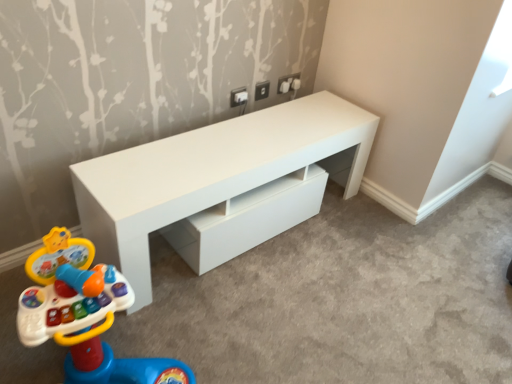
Question: Considering the positions of point (140, 201) and point (111, 281), is point (140, 201) closer or farther from the camera than point (111, 281)?

Choices:
 (A) closer
 (B) farther

Answer: (B)

Question: Is white glossy table at center in front of or behind plastic multicolored xylophone at lower left in the image?

Choices:
 (A) front
 (B) behind

Answer: (B)

Question: Based on their positions, is white glossy table at center located to the left or right of plastic multicolored xylophone at lower left?

Choices:
 (A) left
 (B) right

Answer: (B)

Question: From the image's perspective, is plastic multicolored xylophone at lower left positioned above or below white glossy table at center?

Choices:
 (A) below
 (B) above

Answer: (A)

Question: Considering the relative positions of plastic multicolored xylophone at lower left and white glossy table at center in the image provided, is plastic multicolored xylophone at lower left to the left or to the right of white glossy table at center?

Choices:
 (A) left
 (B) right

Answer: (A)

Question: Is plastic multicolored xylophone at lower left in front of or behind white glossy table at center in the image?

Choices:
 (A) front
 (B) behind

Answer: (A)

Question: Looking at their shapes, would you say plastic multicolored xylophone at lower left is wider or thinner than white glossy table at center?

Choices:
 (A) thin
 (B) wide

Answer: (B)